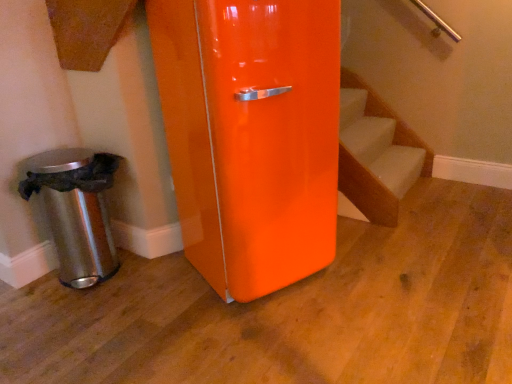
You are a GUI agent. You are given a task and a screenshot of the screen. Output one action in this format:
    pyautogui.click(x=<x>, y=<y>)
    Task: Click on the vacant area that is in front of polished metallic trash can at lower left
    
    Given the screenshot: What is the action you would take?
    pyautogui.click(x=74, y=321)